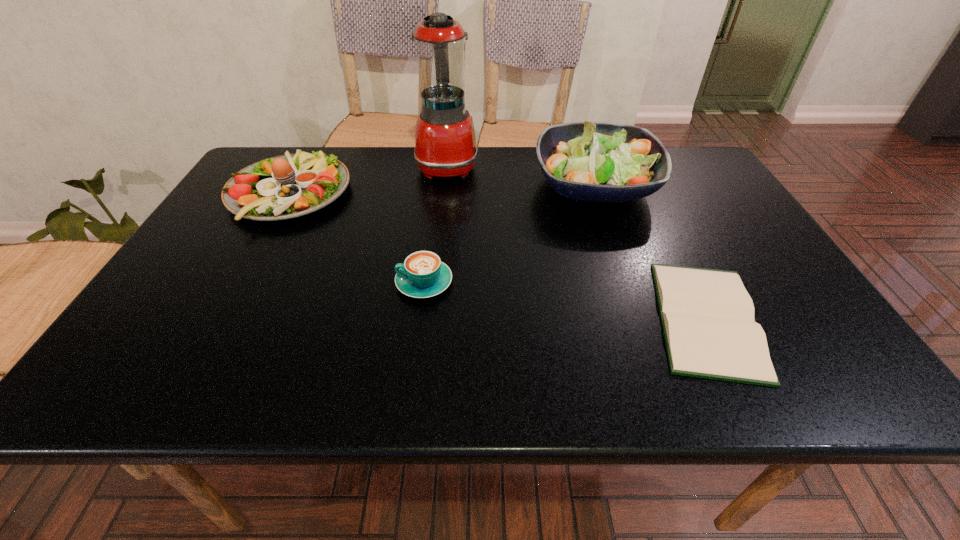
Identify the location of free location at the far edge. (352, 186).

Find the location of a particular element. free space at the near edge of the desktop is located at coordinates (663, 379).

The image size is (960, 540). Identify the location of vacant space at the left edge of the desktop. (218, 210).

The height and width of the screenshot is (540, 960). I want to click on free space at the right edge of the desktop, so click(x=725, y=214).

Where is `vacant space at the far left corner of the desktop`? The image size is (960, 540). vacant space at the far left corner of the desktop is located at coordinates (290, 148).

The width and height of the screenshot is (960, 540). I want to click on vacant area that lies between the cappuccino and the shortest object, so click(x=565, y=301).

Locate an element on the screen. vacant area that lies between the taller salad plate and the fourth tallest object is located at coordinates (510, 234).

You are a GUI agent. You are given a task and a screenshot of the screen. Output one action in this format:
    pyautogui.click(x=<x>, y=<y>)
    Task: Click on the free space that is in between the third shortest object and the fourth shortest object
    
    Given the screenshot: What is the action you would take?
    pyautogui.click(x=443, y=190)

The width and height of the screenshot is (960, 540). What are the coordinates of `free space that is in between the shortest object and the shorter salad plate` in the screenshot? It's located at (498, 256).

This screenshot has width=960, height=540. I want to click on free space that is in between the tallest object and the shortest object, so point(577,242).